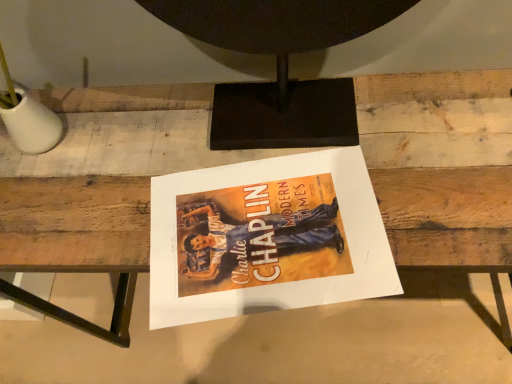
The width and height of the screenshot is (512, 384). Identify the location of wooden table at center. (75, 224).

What do you see at coordinates (75, 224) in the screenshot?
I see `wooden table at center` at bounding box center [75, 224].

What are the coordinates of `wooden table at center` in the screenshot? It's located at (75, 224).